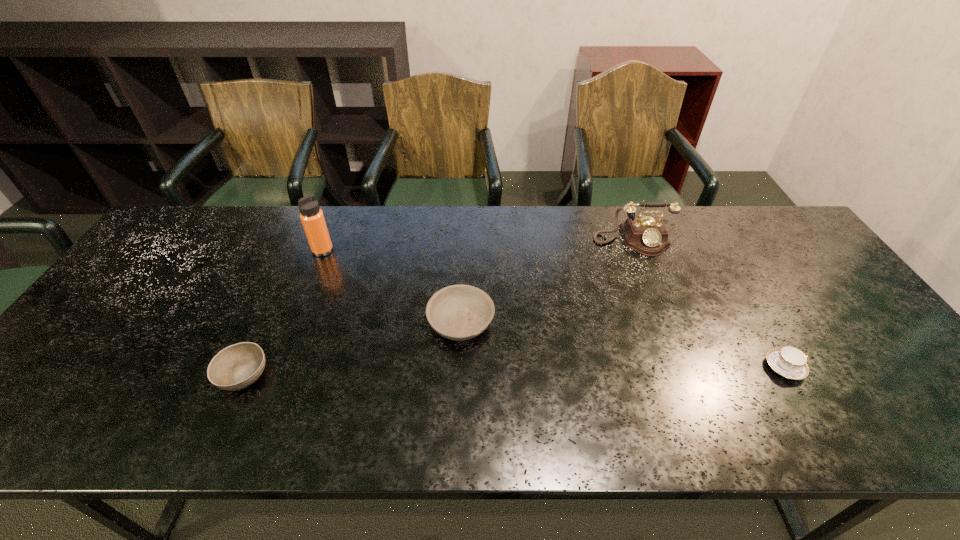
The image size is (960, 540). Find the location of `vacant area situated 0.270m on the back of the left bowl`. vacant area situated 0.270m on the back of the left bowl is located at coordinates (288, 277).

Locate an element on the screen. blank space located 0.150m on the side with the handle of the teacup is located at coordinates (867, 367).

The height and width of the screenshot is (540, 960). Find the location of `thermos bottle that is at the far edge`. thermos bottle that is at the far edge is located at coordinates (312, 218).

Locate an element on the screen. This screenshot has width=960, height=540. telephone present at the far edge is located at coordinates (647, 235).

In the image, there is a desktop. At what (x,y) coordinates should I click in order to perform the action: click on vacant region at the far edge. Please return your answer as a coordinate pair (x, y). The width and height of the screenshot is (960, 540). Looking at the image, I should click on (463, 244).

Where is `free spot at the near edge of the desktop`? The image size is (960, 540). free spot at the near edge of the desktop is located at coordinates (850, 422).

In the image, there is a desktop. Where is `free region at the left edge`? Image resolution: width=960 pixels, height=540 pixels. free region at the left edge is located at coordinates (161, 282).

You are a GUI agent. You are given a task and a screenshot of the screen. Output one action in this format:
    pyautogui.click(x=<x>, y=<y>)
    Task: Click on the free space at the right edge of the desktop
    
    Given the screenshot: What is the action you would take?
    pyautogui.click(x=902, y=399)

Locate an element on the screen. This screenshot has width=960, height=540. vacant space at the far left corner of the desktop is located at coordinates (209, 218).

Identify the location of blank space at the near left corner. (87, 415).